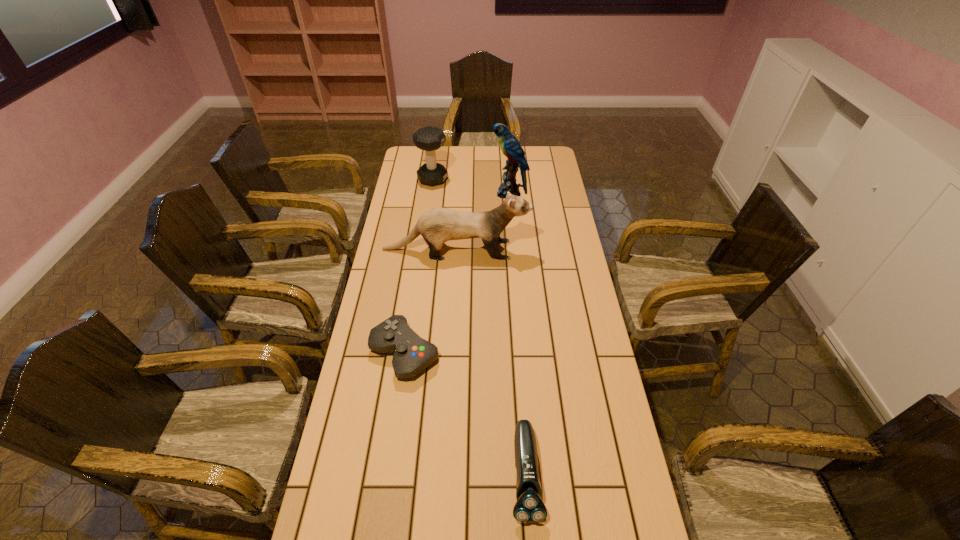
The image size is (960, 540). I want to click on vacant space located 0.320m on the right of the fourth farthest object, so click(x=541, y=353).

Locate an element on the screen. object at the far edge is located at coordinates (429, 138).

Where is `ferret at the left edge`? Image resolution: width=960 pixels, height=540 pixels. ferret at the left edge is located at coordinates (438, 225).

Find the location of a particular element. Image resolution: width=960 pixels, height=540 pixels. dumbbell present at the left edge is located at coordinates (429, 138).

Where is `control that is at the left edge`? The image size is (960, 540). control that is at the left edge is located at coordinates (412, 354).

Find the location of a particular element. The image size is (960, 540). object present at the far left corner is located at coordinates (429, 138).

The width and height of the screenshot is (960, 540). In order to click on free space at the far edge of the desktop in this screenshot , I will do `click(497, 155)`.

What are the coordinates of `vacant space at the left edge of the desktop` in the screenshot? It's located at (422, 243).

Locate an element on the screen. This screenshot has height=540, width=960. free space at the right edge is located at coordinates (606, 493).

In the image, there is a desktop. What are the coordinates of `vacant space at the far right corner` in the screenshot? It's located at (533, 157).